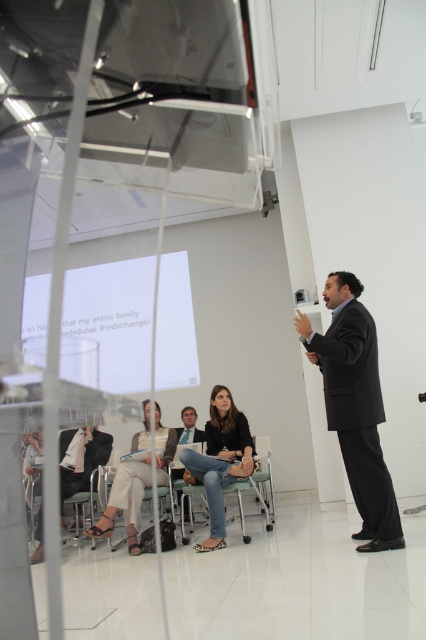
Question: Which point appears farthest from the camera in this image?

Choices:
 (A) (209, 477)
 (B) (397, 540)
 (C) (94, 532)
 (D) (69, 289)

Answer: (D)

Question: Can you confirm if white paper at center is smaller than black suit at center?

Choices:
 (A) yes
 (B) no

Answer: (B)

Question: Estimate the real-world distances between objects in this image. Which object is farther from the matte black suit at lower left?

Choices:
 (A) light beige fabric pants at lower left
 (B) matte black jacket at center

Answer: (B)

Question: Can you confirm if white paper at center is positioned below matte black suit at lower left?

Choices:
 (A) no
 (B) yes

Answer: (A)

Question: Considering the relative positions of white paper at center and light brown leather suit at center in the image provided, where is white paper at center located with respect to light brown leather suit at center?

Choices:
 (A) above
 (B) below

Answer: (A)

Question: Which object is the closest to the matte black jacket at center?

Choices:
 (A) white paper at center
 (B) light brown leather suit at center
 (C) light beige fabric pants at lower left
 (D) black suit at center

Answer: (C)